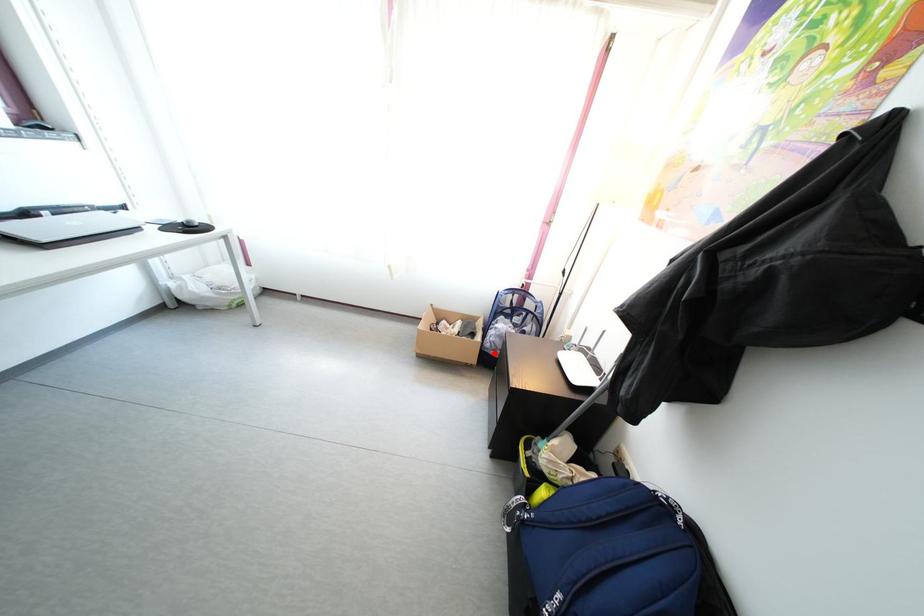
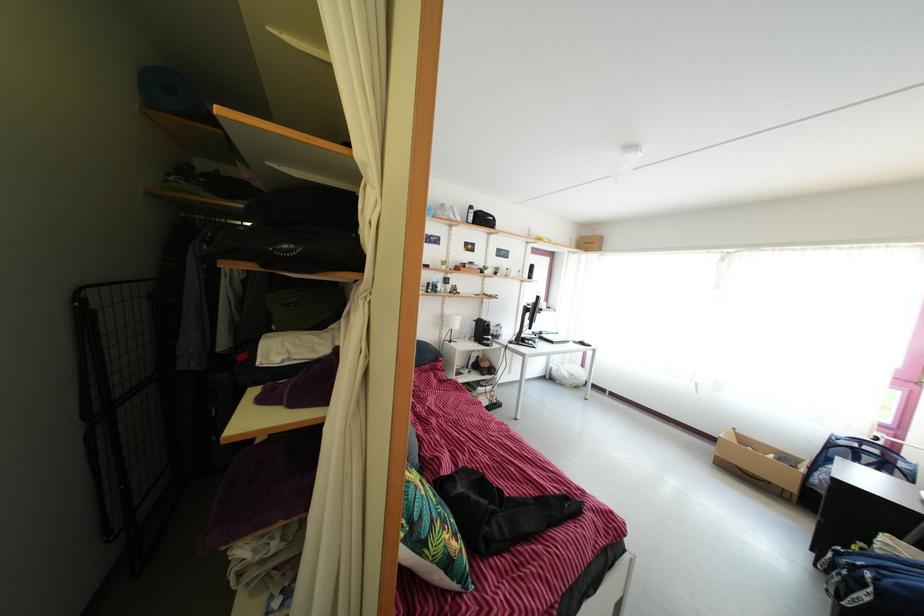
Question: I am providing you with two images of the same scene from different viewpoints. Given a red point in image1, look at the same physical point in image2. Is it:

Choices:
 (A) Closer to the viewpoint
 (B) Farther from the viewpoint

Answer: (B)